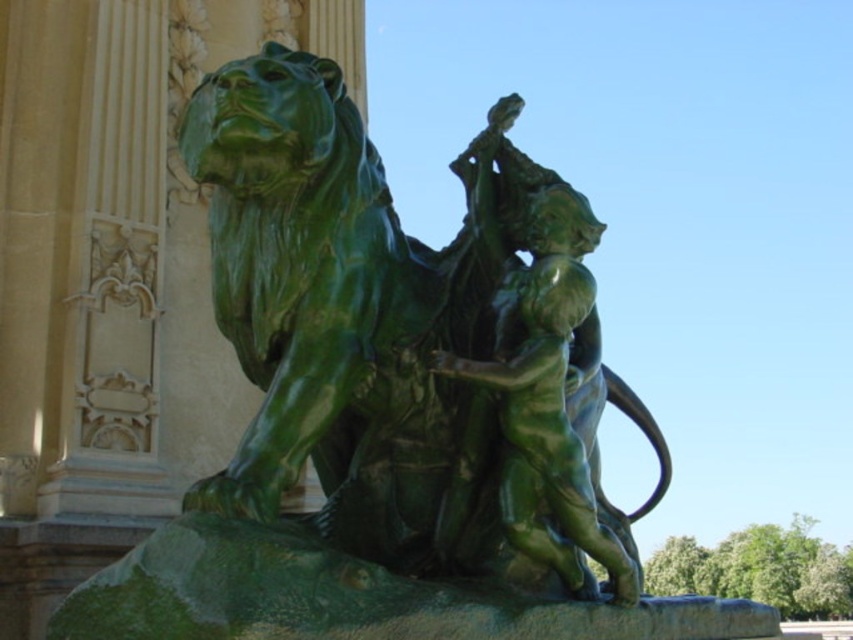
You are an art conservator assessing the stability of the sculpture. Given that the green polished stone lion at center is heavier than the green polished bronze man at center, which part of the sculpture requires more reinforcement to prevent toppling? Explain your reasoning based on their positions and material properties.

The green polished stone lion at center requires more reinforcement because it is taller and heavier than the green polished bronze man at center. Its greater height and weight increase the risk of toppling, especially since it is positioned on the left side of the composition, which may create an uneven weight distribution. Reinforcing the base beneath the lion would help stabilize the sculpture.

You are an art conservator examining the sculpture. You need to clean the green polished stone lion at center and the green polished bronze man at center. Which object should you start with if you want to work from left to right?

The green polished stone lion at center should be cleaned first because it is positioned on the left side of the green polished bronze man at center, so starting from the left follows the left to right sequence.

What are the coordinates of the green polished stone lion at center in the image?

The green polished stone lion at center is located at coordinates (x=409, y=342).